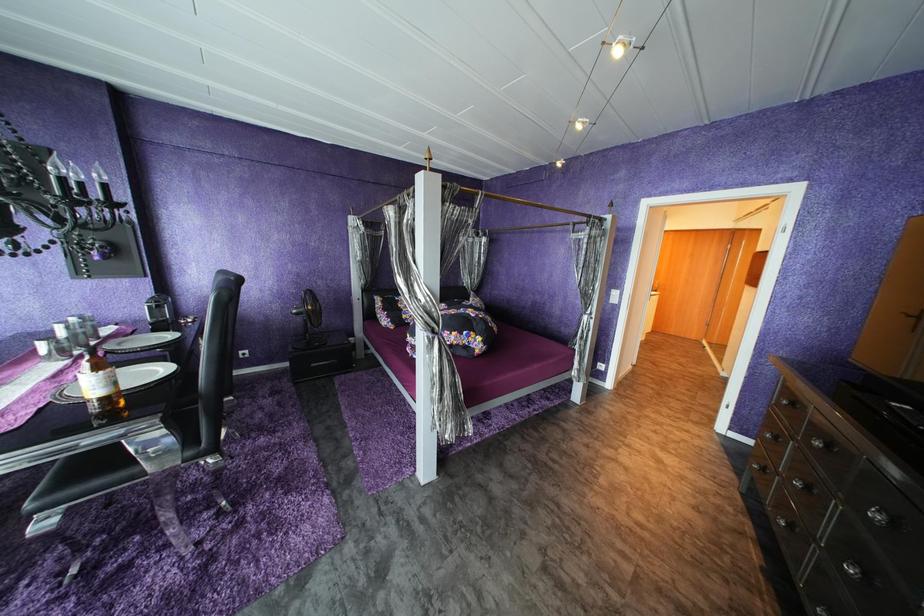
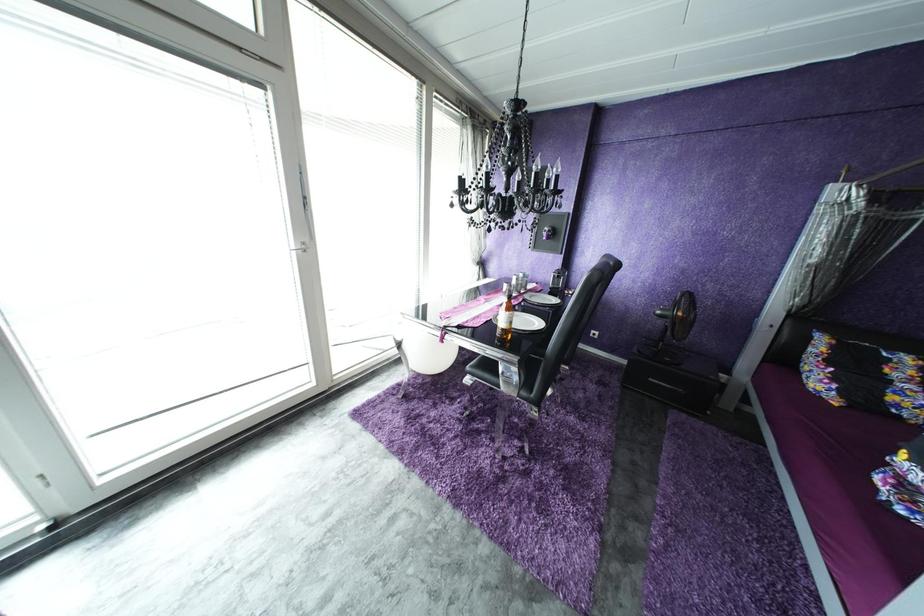
Question: The first image is from the beginning of the video and the second image is from the end. How did the camera likely rotate when shooting the video?

Choices:
 (A) Left
 (B) Right
 (C) Up
 (D) Down

Answer: (A)